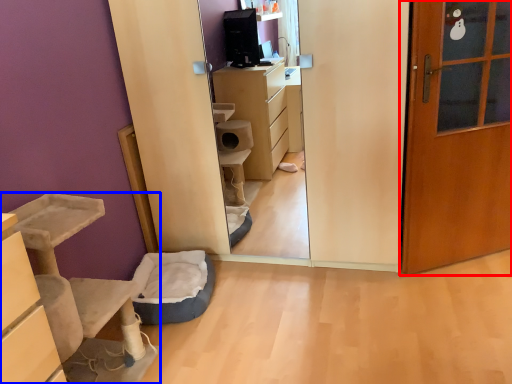
Question: Among these objects, which one is farthest to the camera, door (highlighted by a red box) or furniture (highlighted by a blue box)?

Choices:
 (A) door
 (B) furniture

Answer: (A)